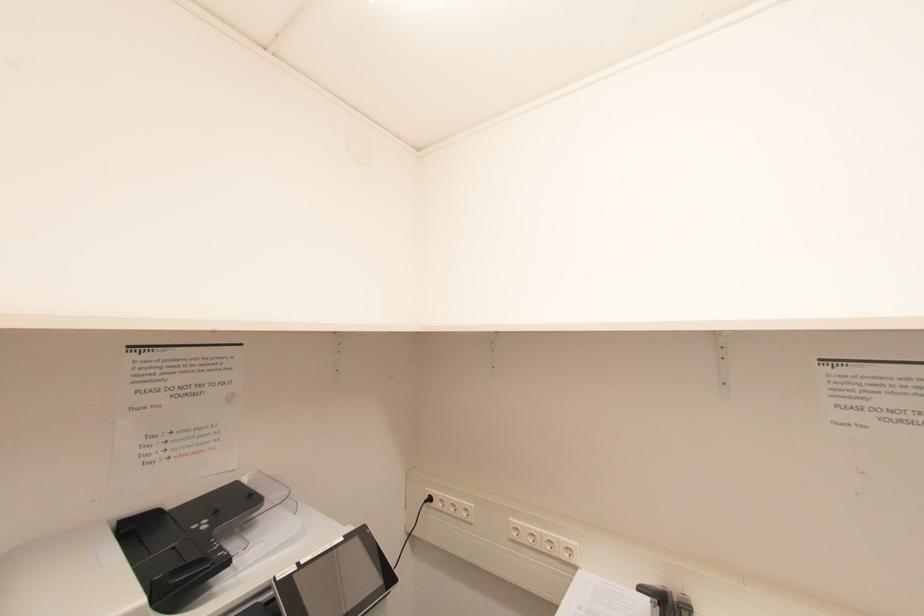
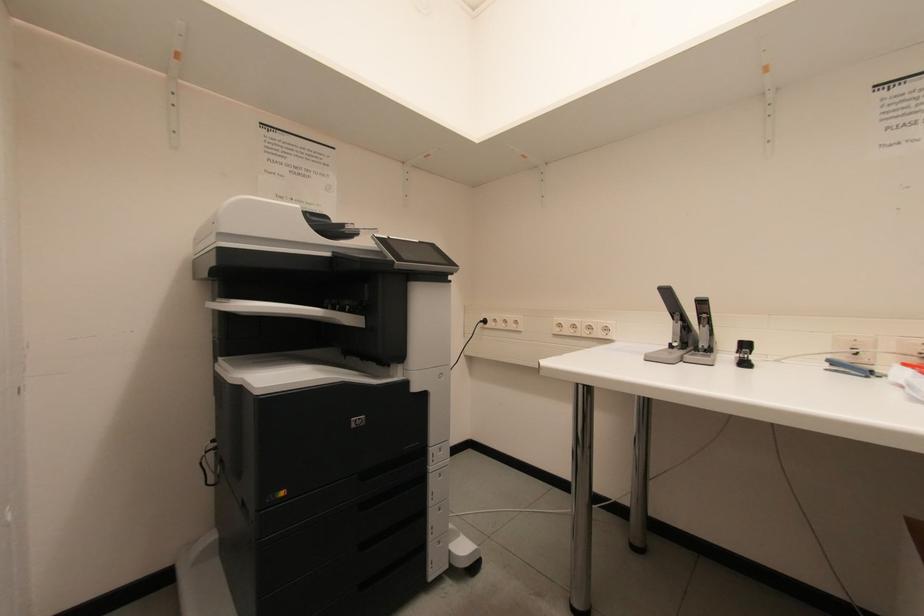
Question: The camera is either moving clockwise (left) or counter-clockwise (right) around the object. The first image is from the beginning of the video and the second image is from the end. Is the camera moving left or right when shooting the video?

Choices:
 (A) Left
 (B) Right

Answer: (B)